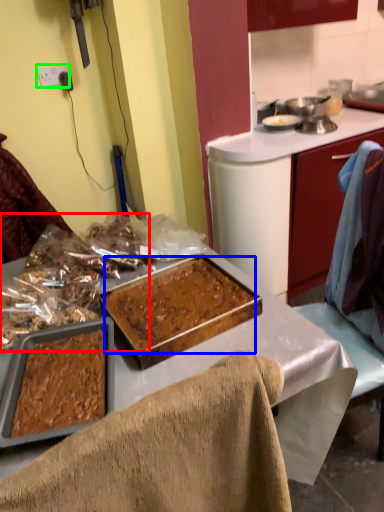
Question: Which object is the farthest from food (highlighted by a red box)? Choose among these: food (highlighted by a blue box) or power outlet (highlighted by a green box).

Choices:
 (A) food
 (B) power outlet

Answer: (B)